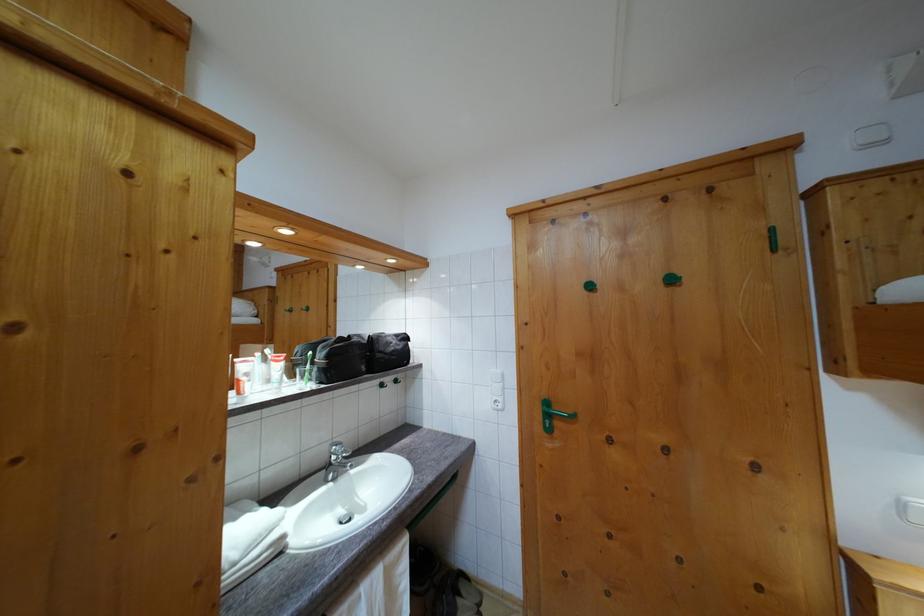
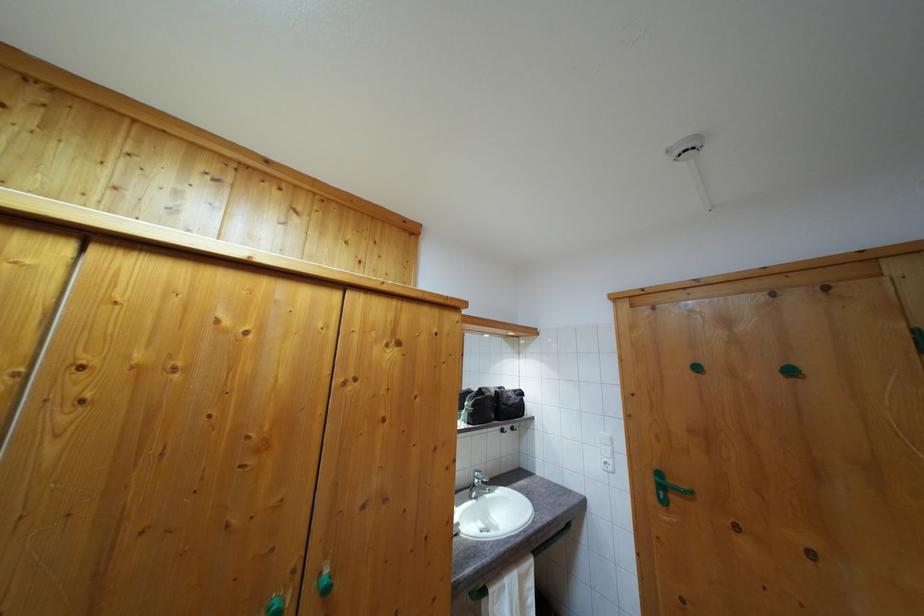
Question: I am providing you with two images of the same scene from different viewpoints. Which of the following objects are not visible in image2?

Choices:
 (A) white light switch
 (B) green cabinet knob
 (C) green door knob
 (D) none of these

Answer: (D)